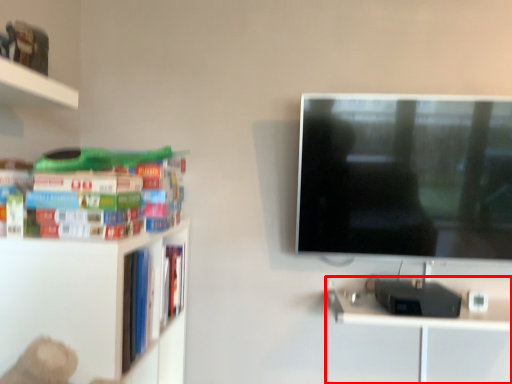
Question: From the image's perspective, where is computer desk (annotated by the red box) located in relation to book in the image?

Choices:
 (A) above
 (B) below

Answer: (B)